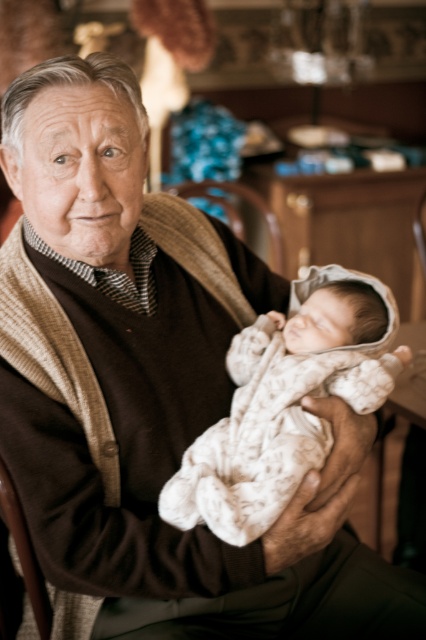
You are a photographer adjusting lighting for a portrait. You notice the white textured fabric at center and the brown leather chair at center. Which object should you focus on to ensure the baby in the scene is properly lit?

The white textured fabric at center is below the brown leather chair at center, so focusing on the brown leather chair at center would better illuminate the baby since it is positioned above the fabric.

You are designing a nursery and want to place the white textured fabric at center so that it is not taller than the brown leather chair at center. Based on the scene, is this arrangement possible?

Yes, the arrangement is possible because the white textured fabric at center has a lesser height compared to the brown leather chair at center, as described.

You are a photographer who wants to capture a closeup shot of the white textured fabric at center. You are currently standing 33.41 inches away from it. Can you get a closer shot without moving the fabric or the elderly man holding the baby?

The white textured fabric at center and viewer are 33.41 inches apart from each other. To get a closer shot without moving the fabric or the elderly man holding the baby, you can use a macro lens or a zoom lens to adjust the focal length, allowing you to capture a detailed closeup from the current distance of 33.41 inches.